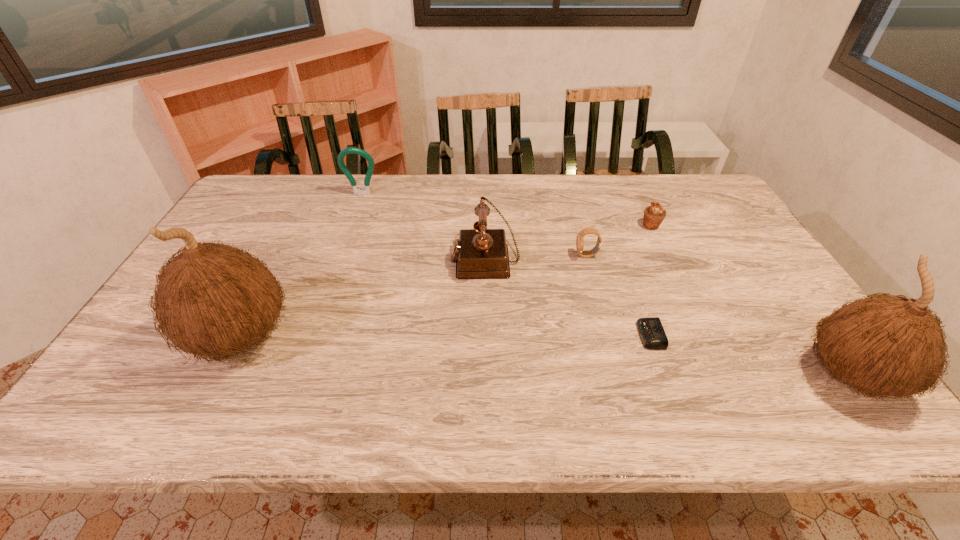
Image resolution: width=960 pixels, height=540 pixels. What are the coordinates of `free space at the far edge of the desktop` in the screenshot? It's located at (609, 184).

Identify the location of free location at the near edge of the desktop. The image size is (960, 540). (330, 363).

What are the coordinates of `vacant space at the right edge of the desktop` in the screenshot? It's located at (728, 213).

In the image, there is a desktop. At what (x,y) coordinates should I click in order to perform the action: click on vacant space at the far left corner. Please return your answer as a coordinate pair (x, y). Image resolution: width=960 pixels, height=540 pixels. Looking at the image, I should click on (269, 191).

Find the location of a particular element. Image resolution: width=960 pixels, height=540 pixels. blank region between the left coconut and the bottle opener is located at coordinates (301, 266).

Where is `empty space that is in between the third object from left to right and the bottle opener`? The height and width of the screenshot is (540, 960). empty space that is in between the third object from left to right and the bottle opener is located at coordinates (423, 226).

Find the location of a particular element. The width and height of the screenshot is (960, 540). vacant space that's between the third object from left to right and the fourth object from left to right is located at coordinates (536, 256).

In order to click on empty location between the sixth shortest object and the tallest object in this screenshot , I will do [x=546, y=357].

At what (x,y) coordinates should I click in order to perform the action: click on empty location between the tallest object and the farthest object. Please return your answer as a coordinate pair (x, y). This screenshot has width=960, height=540. Looking at the image, I should click on (301, 266).

Image resolution: width=960 pixels, height=540 pixels. I want to click on vacant space that's between the shorter coconut and the sixth nearest object, so click(751, 301).